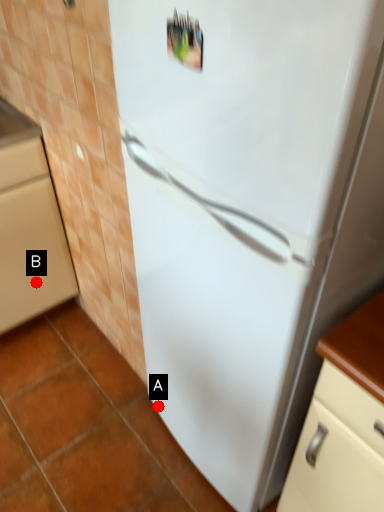
Question: Two points are circled on the image, labeled by A and B beside each circle. Which point is closer to the camera?

Choices:
 (A) A is closer
 (B) B is closer

Answer: (A)